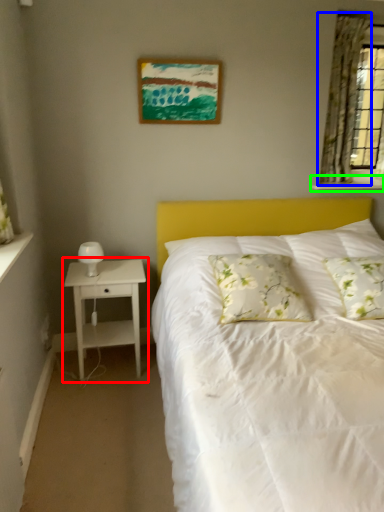
Question: Which object is positioned closest to nightstand (highlighted by a red box)? Select from curtain (highlighted by a blue box) and window sill (highlighted by a green box).

Choices:
 (A) curtain
 (B) window sill

Answer: (B)